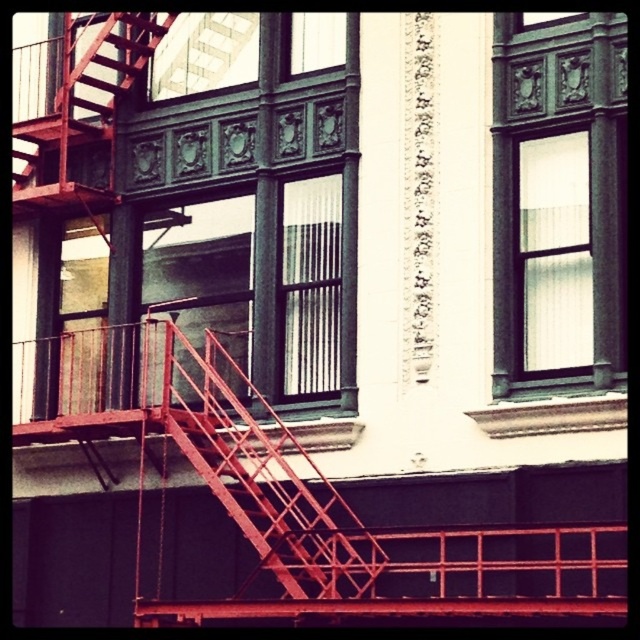
Question: Which point is closer to the camera taking this photo?

Choices:
 (A) (294, 534)
 (B) (328, 51)

Answer: (A)

Question: Estimate the real-world distances between objects in this image. Which object is farther from the clear glass window at upper right?

Choices:
 (A) metallic red fire escape at center
 (B) clear glass window at upper center

Answer: (B)

Question: Is clear glass window at upper right to the right of clear glass window at upper center from the viewer's perspective?

Choices:
 (A) no
 (B) yes

Answer: (B)

Question: From the image, what is the correct spatial relationship of clear glass window at upper right in relation to clear glass window at upper center?

Choices:
 (A) left
 (B) right

Answer: (B)

Question: Which of the following is the farthest from the observer?

Choices:
 (A) (362, 564)
 (B) (336, 65)

Answer: (B)

Question: Is the position of metallic red fire escape at center less distant than that of clear glass window at upper center?

Choices:
 (A) no
 (B) yes

Answer: (B)